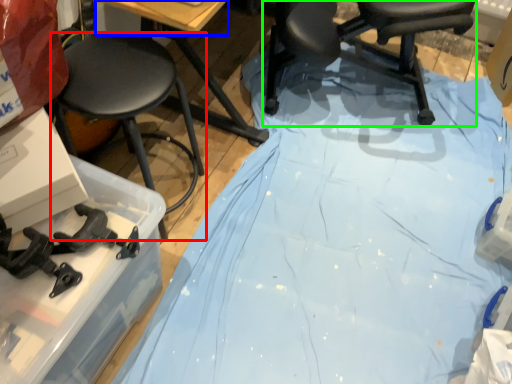
Question: Which object is the closest to the stool (highlighted by a red box)? Choose among these: table top (highlighted by a blue box) or chair (highlighted by a green box).

Choices:
 (A) table top
 (B) chair

Answer: (A)